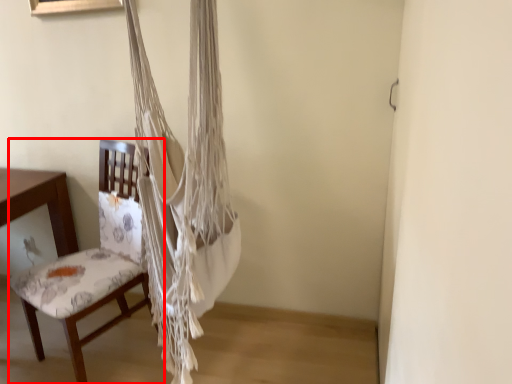
Question: Considering the relative positions of chair (annotated by the red box) and curtain in the image provided, where is chair (annotated by the red box) located with respect to the staircase?

Choices:
 (A) left
 (B) right

Answer: (A)